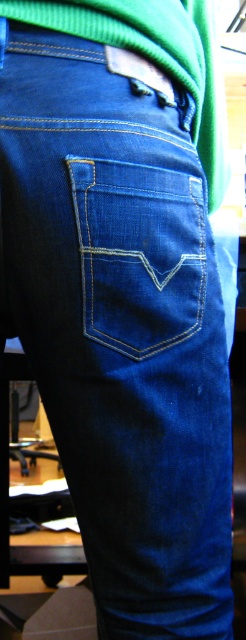
Question: Does denim blue jeans pocket at center have a greater width compared to green cotton sweater at upper center?

Choices:
 (A) yes
 (B) no

Answer: (B)

Question: Is denim blue jeans pocket at center smaller than green cotton sweater at upper center?

Choices:
 (A) no
 (B) yes

Answer: (B)

Question: Which point is farther from the camera taking this photo?

Choices:
 (A) (78, 234)
 (B) (107, 16)

Answer: (B)

Question: Which of the following is the closest to the observer?

Choices:
 (A) (112, 3)
 (B) (185, 292)

Answer: (A)

Question: Which point is farther to the camera?

Choices:
 (A) denim blue jeans pocket at center
 (B) green cotton sweater at upper center

Answer: (B)

Question: Does denim blue jeans pocket at center have a smaller size compared to green cotton sweater at upper center?

Choices:
 (A) no
 (B) yes

Answer: (B)